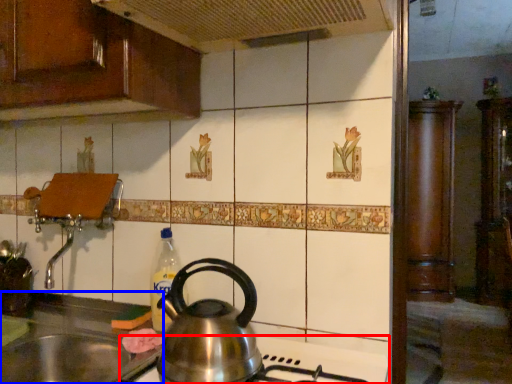
Question: Which object is further to the camera taking this photo, gas stove (highlighted by a red box) or sink (highlighted by a blue box)?

Choices:
 (A) gas stove
 (B) sink

Answer: (B)